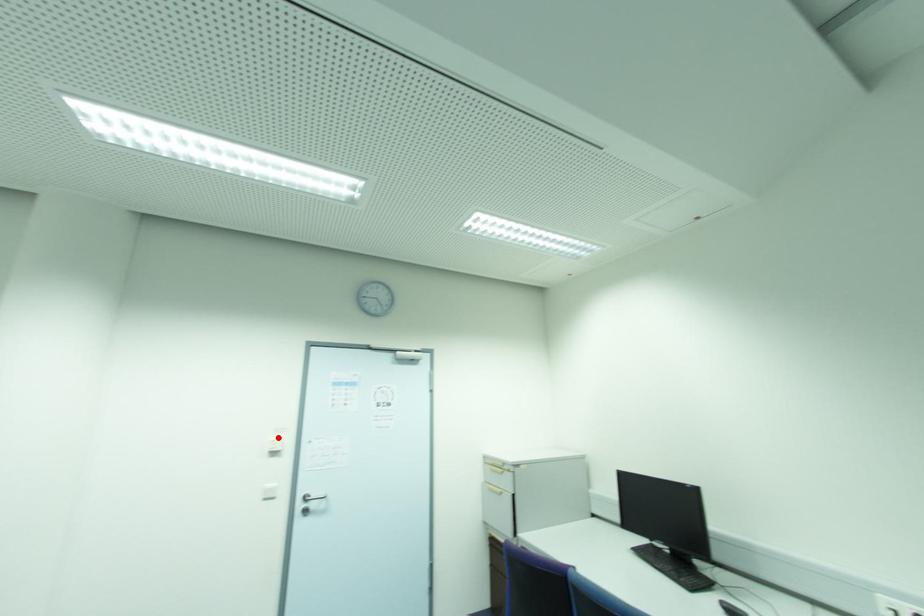
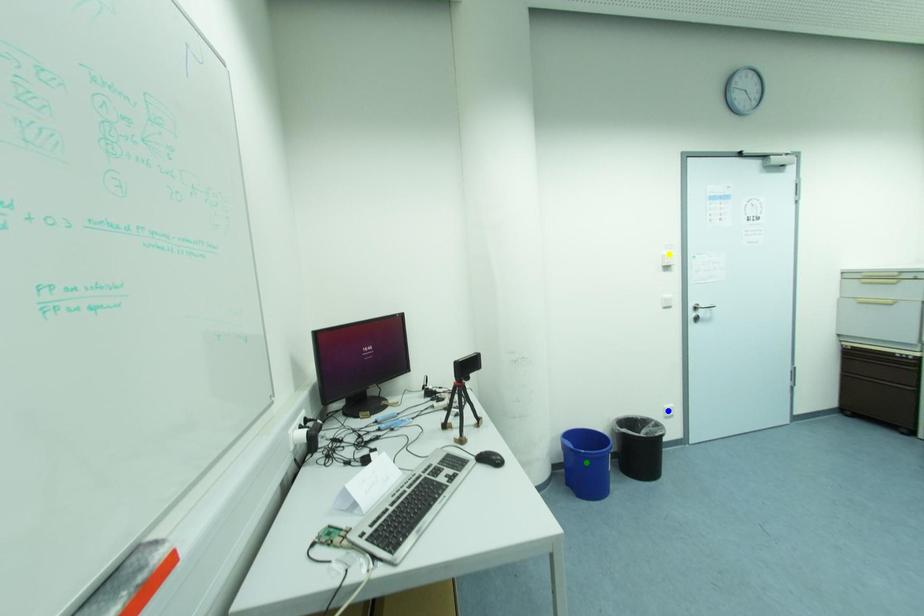
Question: I am providing you with two images of the same scene from different viewpoints. A red point is marked on the first image. You are given multiple points on the second image. Which point in image 2 represents the same 3d spot as the red point in image 1?

Choices:
 (A) blue point
 (B) green point
 (C) yellow point

Answer: (C)